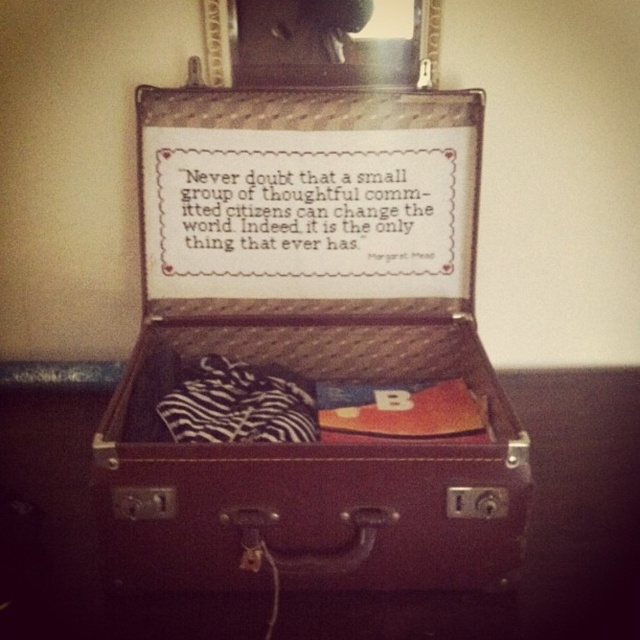
Question: Which point is closer to the camera?

Choices:
 (A) leather suitcase at center
 (B) metallic mirror at upper center
 (C) zebra-patterned fabric at center

Answer: (A)

Question: Does leather suitcase at center have a lesser width compared to metallic mirror at upper center?

Choices:
 (A) no
 (B) yes

Answer: (A)

Question: Which point appears farthest from the camera in this image?

Choices:
 (A) (163, 342)
 (B) (285, 12)

Answer: (A)

Question: Considering the relative positions of leather suitcase at center and metallic mirror at upper center in the image provided, where is leather suitcase at center located with respect to metallic mirror at upper center?

Choices:
 (A) left
 (B) right

Answer: (A)

Question: Among these objects, which one is farthest from the camera?

Choices:
 (A) zebra-patterned fabric at center
 (B) metallic mirror at upper center

Answer: (B)

Question: From the image, what is the correct spatial relationship of metallic mirror at upper center in relation to zebra-patterned fabric at center?

Choices:
 (A) left
 (B) right

Answer: (B)